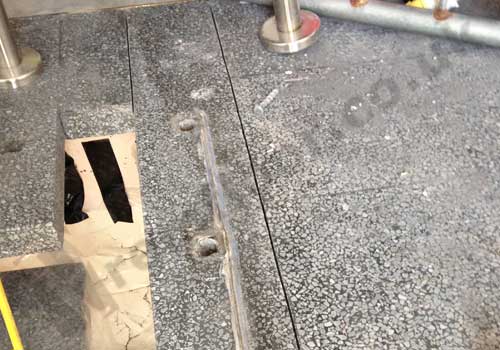
Identify the location of tile floor. (124, 320).